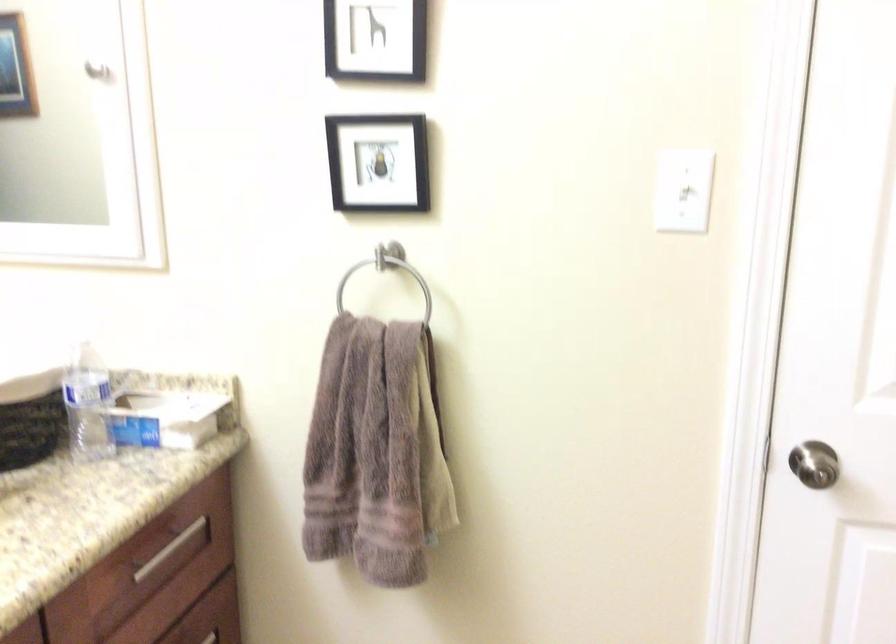
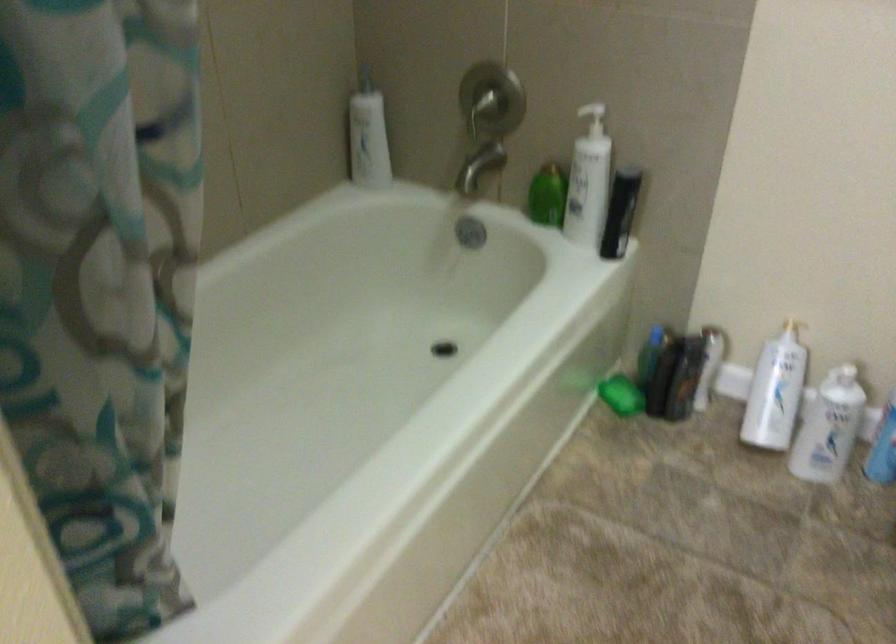
Based on the continuous images, in which direction is the camera rotating?

The rotation direction of the camera is right-down.